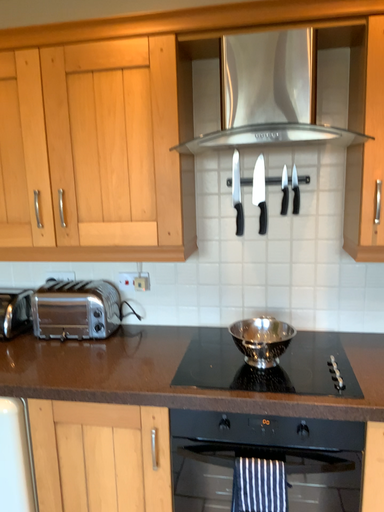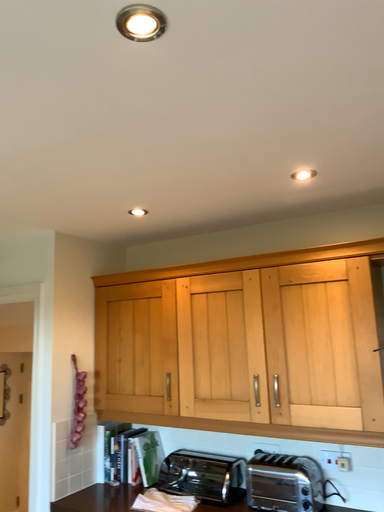
Question: How did the camera likely rotate when shooting the video?

Choices:
 (A) rotated left
 (B) rotated right

Answer: (A)